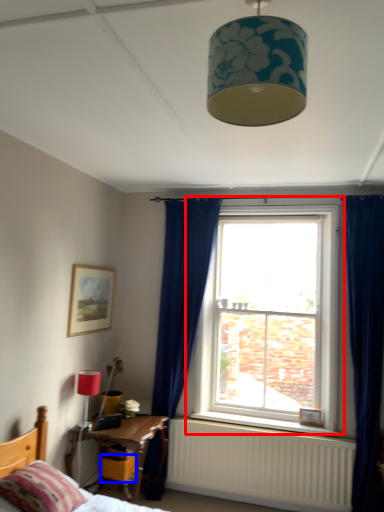
Question: Which object is closer to the camera taking this photo, window (highlighted by a red box) or drawer (highlighted by a blue box)?

Choices:
 (A) window
 (B) drawer

Answer: (B)